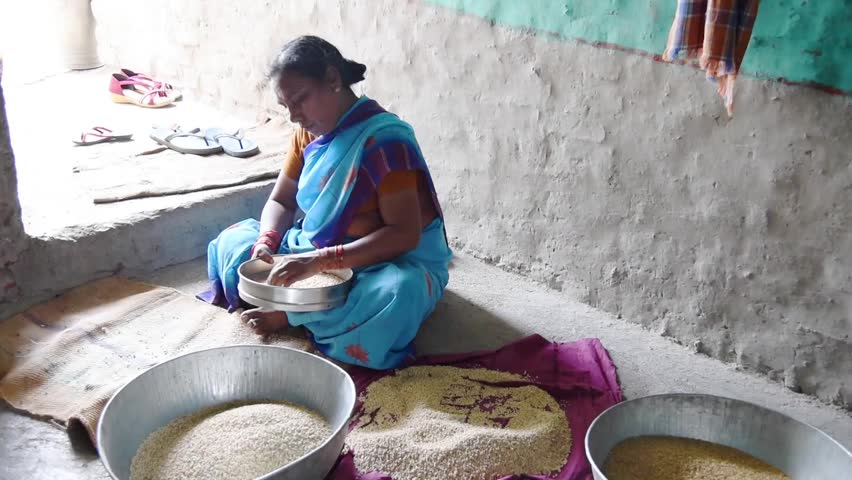
You are a GUI agent. You are given a task and a screenshot of the screen. Output one action in this format:
    pyautogui.click(x=<x>, y=<y>)
    Task: Click on the bowl with darker grain
    
    Given the screenshot: What is the action you would take?
    pyautogui.click(x=682, y=440)